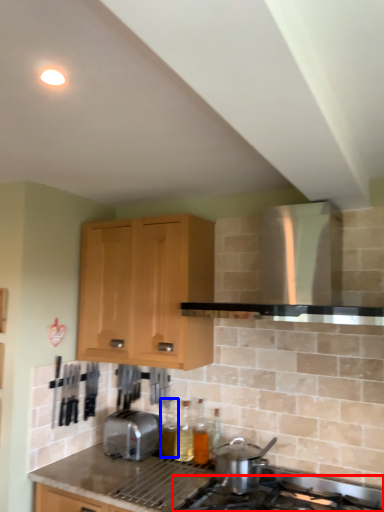
Question: Which point is closer to the camera, gas stove (highlighted by a red box) or bottle (highlighted by a blue box)?

Choices:
 (A) gas stove
 (B) bottle

Answer: (A)